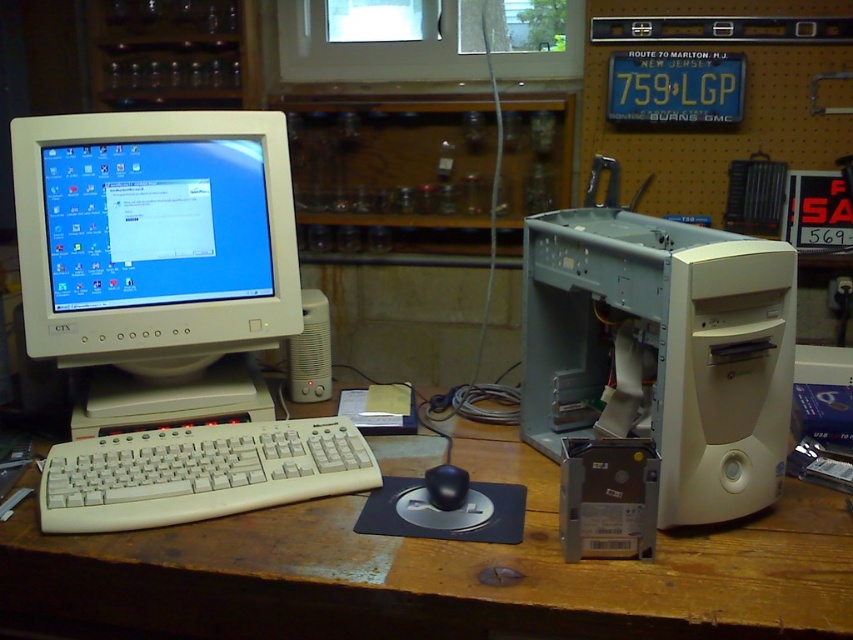
You are setting up a new desk and want to place a small plant between the matte white monitor at left and the black plastic mouse at center. Considering their sizes, which object should the plant be closer to?

The matte white monitor at left is much taller than the black plastic mouse at center, so the plant should be placed closer to the black plastic mouse at center to ensure there is enough space between them.

Based on the scene description, where is the white wood computer desk at center located in terms of coordinates?

The white wood computer desk at center is located at coordinates point (x=444, y=572).